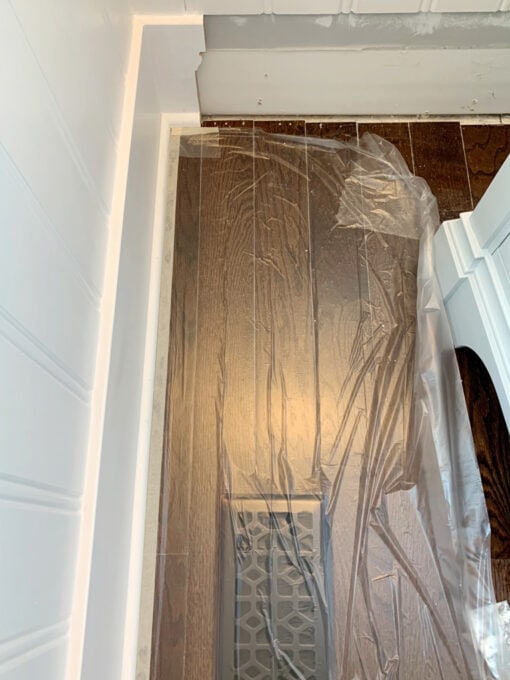
Find the location of `white paint`. white paint is located at coordinates (238, 20), (422, 26).